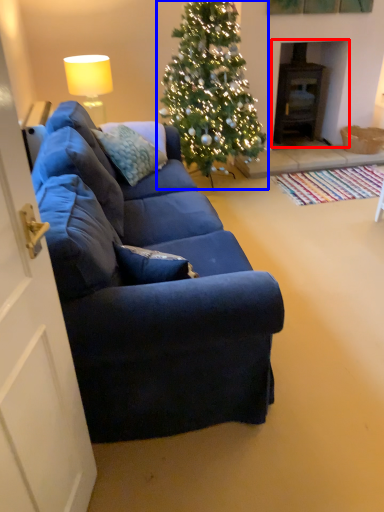
Question: Which object is further to the camera taking this photo, fireplace (highlighted by a red box) or christmas tree (highlighted by a blue box)?

Choices:
 (A) fireplace
 (B) christmas tree

Answer: (A)